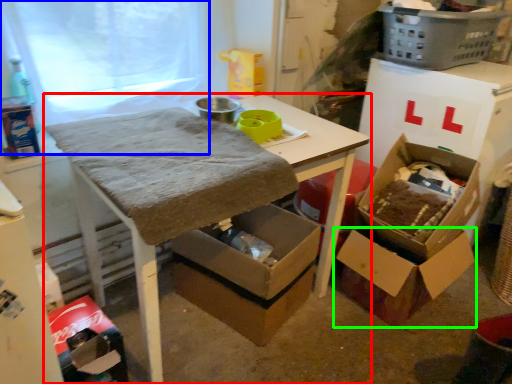
Question: Estimate the real-world distances between objects in this image. Which object is closer to table (highlighted by a red box), window screen (highlighted by a blue box) or box (highlighted by a green box)?

Choices:
 (A) window screen
 (B) box

Answer: (B)